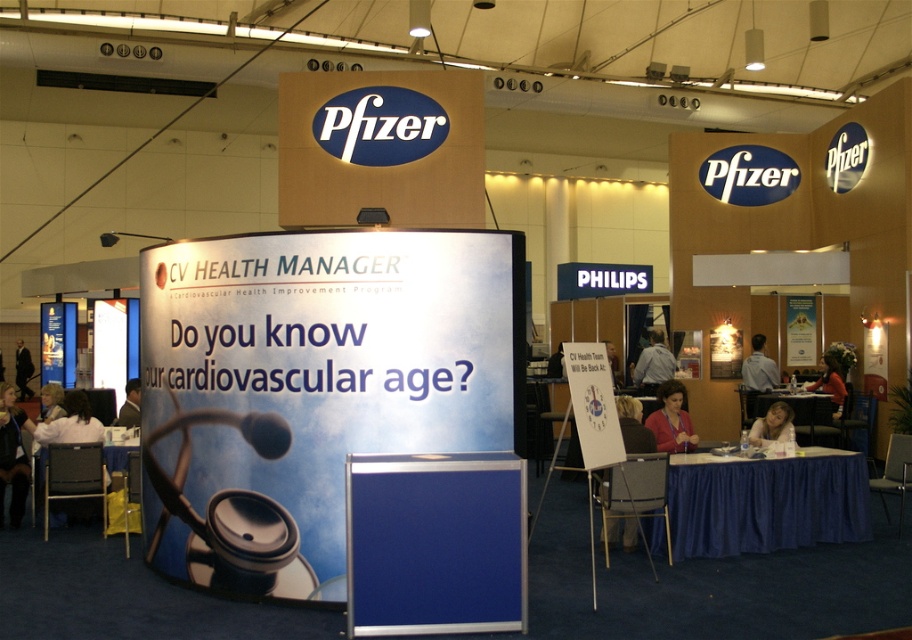
Does blonde hair at lower right have a larger size compared to dark brown hair at center?

Incorrect, blonde hair at lower right is not larger than dark brown hair at center.

Between blonde hair at lower right and dark brown hair at center, which one appears on the left side from the viewer's perspective?

From the viewer's perspective, blonde hair at lower right appears more on the left side.

Which is in front, point (763, 440) or point (838, 392)?

Point (763, 440) is more forward.

Locate an element on the screen. The image size is (912, 640). blonde hair at lower right is located at coordinates (772, 426).

Between blue velvet table at lower right and matte pink blouse at center, which one appears on the right side from the viewer's perspective?

blue velvet table at lower right is more to the right.

Is blue velvet table at lower right wider than matte pink blouse at center?

Yes.

The height and width of the screenshot is (640, 912). Identify the location of blue velvet table at lower right. (765, 502).

How distant is white shirt at center from dark blue suit at left?

A distance of 15.77 meters exists between white shirt at center and dark blue suit at left.

Does white shirt at center appear on the left side of dark blue suit at left?

No, white shirt at center is not to the left of dark blue suit at left.

What do you see at coordinates (759, 368) in the screenshot?
I see `white shirt at center` at bounding box center [759, 368].

Where is `white shirt at center`? The width and height of the screenshot is (912, 640). white shirt at center is located at coordinates (759, 368).